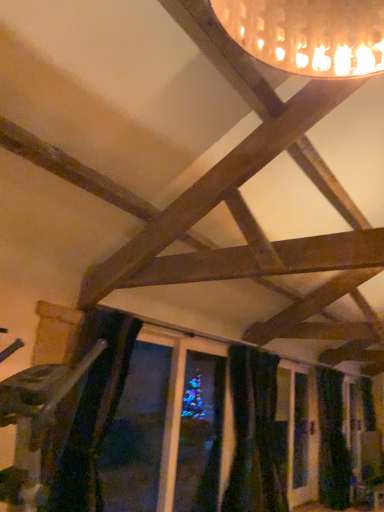
Describe the element at coordinates (254, 434) in the screenshot. This screenshot has height=512, width=384. I see `black velvet curtain at lower center, the second curtain viewed from the right` at that location.

How much space does black velvet curtain at lower center, placed as the 1th curtain when sorted from left to right, occupy vertically?

black velvet curtain at lower center, placed as the 1th curtain when sorted from left to right, is 1.69 meters in height.

Find the location of a particular element. black velvet curtain at lower center, placed as the 1th curtain when sorted from front to back is located at coordinates (254, 434).

Find the location of a particular element. dark blue velvet curtain at lower right, which is the 1th curtain in right-to-left order is located at coordinates (332, 442).

The image size is (384, 512). Describe the element at coordinates (332, 442) in the screenshot. I see `dark blue velvet curtain at lower right, which is counted as the 2th curtain, starting from the front` at that location.

Measure the distance between dark blue velvet curtain at lower right, positioned as the second curtain in left-to-right order, and camera.

The distance of dark blue velvet curtain at lower right, positioned as the second curtain in left-to-right order, from camera is 16.02 feet.

Where is `black velvet curtain at lower center, which is the second curtain from back to front`? The image size is (384, 512). black velvet curtain at lower center, which is the second curtain from back to front is located at coordinates (254, 434).

Considering the relative positions of dark blue velvet curtain at lower right, which is counted as the 2th curtain, starting from the front, and black velvet curtain at lower center, placed as the 1th curtain when sorted from left to right, in the image provided, is dark blue velvet curtain at lower right, which is counted as the 2th curtain, starting from the front, to the left of black velvet curtain at lower center, placed as the 1th curtain when sorted from left to right, from the viewer's perspective?

No.

Is the depth of dark blue velvet curtain at lower right, which is counted as the 2th curtain, starting from the front, greater than that of black velvet curtain at lower center, placed as the 1th curtain when sorted from front to back?

Yes, it is.

Considering the points (348, 496) and (256, 505), which point is behind, point (348, 496) or point (256, 505)?

The point (348, 496) is behind.

From the image's perspective, is dark blue velvet curtain at lower right, which is counted as the 2th curtain, starting from the front, on top of black velvet curtain at lower center, placed as the 1th curtain when sorted from left to right?

No, from the image's perspective, dark blue velvet curtain at lower right, which is counted as the 2th curtain, starting from the front, is not on top of black velvet curtain at lower center, placed as the 1th curtain when sorted from left to right.

From the picture: From a real-world perspective, is dark blue velvet curtain at lower right, positioned as the second curtain in left-to-right order, positioned under black velvet curtain at lower center, placed as the 1th curtain when sorted from front to back, based on gravity?

Yes, from a real-world perspective, dark blue velvet curtain at lower right, positioned as the second curtain in left-to-right order, is under black velvet curtain at lower center, placed as the 1th curtain when sorted from front to back.

Considering the relative sizes of dark blue velvet curtain at lower right, positioned as the second curtain in left-to-right order, and black velvet curtain at lower center, placed as the 1th curtain when sorted from front to back, in the image provided, is dark blue velvet curtain at lower right, positioned as the second curtain in left-to-right order, thinner than black velvet curtain at lower center, placed as the 1th curtain when sorted from front to back,?

Yes, dark blue velvet curtain at lower right, positioned as the second curtain in left-to-right order, is thinner than black velvet curtain at lower center, placed as the 1th curtain when sorted from front to back.

Between dark blue velvet curtain at lower right, positioned as the first curtain in back-to-front order, and black velvet curtain at lower center, placed as the 1th curtain when sorted from front to back, which one has less height?

black velvet curtain at lower center, placed as the 1th curtain when sorted from front to back.

Is dark blue velvet curtain at lower right, positioned as the second curtain in left-to-right order, smaller than black velvet curtain at lower center, the second curtain viewed from the right?

Indeed, dark blue velvet curtain at lower right, positioned as the second curtain in left-to-right order, has a smaller size compared to black velvet curtain at lower center, the second curtain viewed from the right.

Is dark blue velvet curtain at lower right, positioned as the first curtain in back-to-front order, positioned beyond the bounds of black velvet curtain at lower center, the second curtain viewed from the right?

dark blue velvet curtain at lower right, positioned as the first curtain in back-to-front order, lies outside black velvet curtain at lower center, the second curtain viewed from the right,'s area.

Are dark blue velvet curtain at lower right, positioned as the first curtain in back-to-front order, and black velvet curtain at lower center, placed as the 1th curtain when sorted from front to back, making contact?

No, dark blue velvet curtain at lower right, positioned as the first curtain in back-to-front order, is not in contact with black velvet curtain at lower center, placed as the 1th curtain when sorted from front to back.

Looking at this image, is dark blue velvet curtain at lower right, which is the 1th curtain in right-to-left order, oriented towards black velvet curtain at lower center, placed as the 1th curtain when sorted from front to back?

No, dark blue velvet curtain at lower right, which is the 1th curtain in right-to-left order, is not aimed at black velvet curtain at lower center, placed as the 1th curtain when sorted from front to back.

How many degrees apart are the facing directions of dark blue velvet curtain at lower right, which is counted as the 2th curtain, starting from the front, and black velvet curtain at lower center, placed as the 1th curtain when sorted from left to right?

dark blue velvet curtain at lower right, which is counted as the 2th curtain, starting from the front, and black velvet curtain at lower center, placed as the 1th curtain when sorted from left to right, are facing 0.0029 degrees away from each other.

How distant is dark blue velvet curtain at lower right, which is the 1th curtain in right-to-left order, from black velvet curtain at lower center, placed as the 1th curtain when sorted from left to right?

The distance of dark blue velvet curtain at lower right, which is the 1th curtain in right-to-left order, from black velvet curtain at lower center, placed as the 1th curtain when sorted from left to right, is 1.05 meters.

The image size is (384, 512). In order to click on curtain on the left side of dark blue velvet curtain at lower right, which is counted as the 2th curtain, starting from the front in this screenshot , I will do `click(254, 434)`.

Considering the relative positions of black velvet curtain at lower center, placed as the 1th curtain when sorted from front to back, and dark blue velvet curtain at lower right, which is the 1th curtain in right-to-left order, in the image provided, is black velvet curtain at lower center, placed as the 1th curtain when sorted from front to back, to the left or to the right of dark blue velvet curtain at lower right, which is the 1th curtain in right-to-left order,?

black velvet curtain at lower center, placed as the 1th curtain when sorted from front to back, is positioned on dark blue velvet curtain at lower right, which is the 1th curtain in right-to-left order,'s left side.

Who is more distant, black velvet curtain at lower center, which is the second curtain from back to front, or dark blue velvet curtain at lower right, which is counted as the 2th curtain, starting from the front?

dark blue velvet curtain at lower right, which is counted as the 2th curtain, starting from the front, is behind.

Does point (250, 387) come in front of point (334, 502)?

That is True.

From the image's perspective, is black velvet curtain at lower center, placed as the 1th curtain when sorted from left to right, beneath dark blue velvet curtain at lower right, positioned as the first curtain in back-to-front order?

Actually, black velvet curtain at lower center, placed as the 1th curtain when sorted from left to right, appears above dark blue velvet curtain at lower right, positioned as the first curtain in back-to-front order, in the image.

From a real-world perspective, relative to dark blue velvet curtain at lower right, positioned as the first curtain in back-to-front order, is black velvet curtain at lower center, placed as the 1th curtain when sorted from left to right, vertically above or below?

black velvet curtain at lower center, placed as the 1th curtain when sorted from left to right, is above dark blue velvet curtain at lower right, positioned as the first curtain in back-to-front order.

Can you confirm if black velvet curtain at lower center, the second curtain viewed from the right, is thinner than dark blue velvet curtain at lower right, which is counted as the 2th curtain, starting from the front?

Incorrect, the width of black velvet curtain at lower center, the second curtain viewed from the right, is not less than that of dark blue velvet curtain at lower right, which is counted as the 2th curtain, starting from the front.

Does black velvet curtain at lower center, placed as the 1th curtain when sorted from front to back, have a lesser height compared to dark blue velvet curtain at lower right, which is counted as the 2th curtain, starting from the front?

Yes, black velvet curtain at lower center, placed as the 1th curtain when sorted from front to back, is shorter than dark blue velvet curtain at lower right, which is counted as the 2th curtain, starting from the front.

Which of these two, black velvet curtain at lower center, placed as the 1th curtain when sorted from front to back, or dark blue velvet curtain at lower right, which is the 1th curtain in right-to-left order, is bigger?

Bigger between the two is black velvet curtain at lower center, placed as the 1th curtain when sorted from front to back.

Would you say black velvet curtain at lower center, placed as the 1th curtain when sorted from left to right, is outside dark blue velvet curtain at lower right, which is counted as the 2th curtain, starting from the front?

Indeed, black velvet curtain at lower center, placed as the 1th curtain when sorted from left to right, is completely outside dark blue velvet curtain at lower right, which is counted as the 2th curtain, starting from the front.

Would you say black velvet curtain at lower center, placed as the 1th curtain when sorted from front to back, is a long distance from dark blue velvet curtain at lower right, which is counted as the 2th curtain, starting from the front?

black velvet curtain at lower center, placed as the 1th curtain when sorted from front to back, is far away from dark blue velvet curtain at lower right, which is counted as the 2th curtain, starting from the front.

Does black velvet curtain at lower center, the second curtain viewed from the right, turn towards dark blue velvet curtain at lower right, positioned as the first curtain in back-to-front order?

No, black velvet curtain at lower center, the second curtain viewed from the right, is not oriented towards dark blue velvet curtain at lower right, positioned as the first curtain in back-to-front order.

The width and height of the screenshot is (384, 512). Identify the location of curtain below the black velvet curtain at lower center, placed as the 1th curtain when sorted from front to back (from a real-world perspective). (332, 442).

Find the location of a particular element. curtain on the right of black velvet curtain at lower center, which is the second curtain from back to front is located at coordinates (332, 442).

Find the location of a particular element. curtain above the dark blue velvet curtain at lower right, positioned as the second curtain in left-to-right order (from a real-world perspective) is located at coordinates (254, 434).